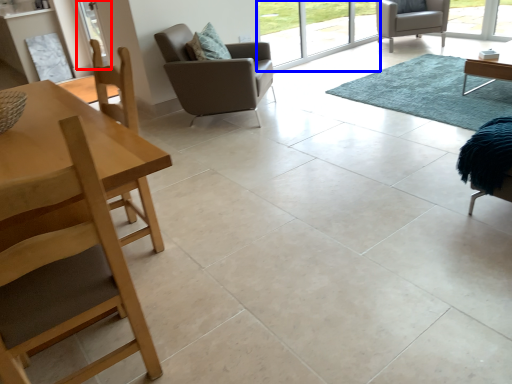
Question: Which object is closer to the camera taking this photo, screen door (highlighted by a red box) or window screen (highlighted by a blue box)?

Choices:
 (A) screen door
 (B) window screen

Answer: (B)